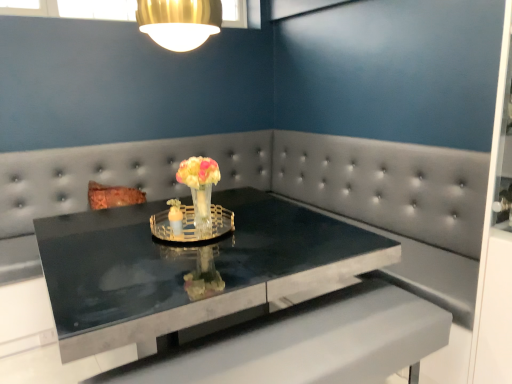
Image resolution: width=512 pixels, height=384 pixels. What do you see at coordinates (188, 267) in the screenshot?
I see `black marble table at center` at bounding box center [188, 267].

Locate an element on the screen. clear glass candle holder at center, acting as the second candle holder starting from the left is located at coordinates pyautogui.click(x=192, y=225).

This screenshot has width=512, height=384. Find the location of `black marble table at center`. black marble table at center is located at coordinates (188, 267).

Does point (178, 224) come farther from viewer compared to point (205, 218)?

That is False.

How different are the orientations of translucent glass candle holder at center, which is the 1th candle holder from left to right, and translucent glass vase at center in degrees?

0.000926 degrees.

Looking at their sizes, would you say translucent glass candle holder at center, which is the 1th candle holder from left to right, is wider or thinner than translucent glass vase at center?

In the image, translucent glass candle holder at center, which is the 1th candle holder from left to right, appears to be more narrow than translucent glass vase at center.

Does translucent glass candle holder at center, which is the 1th candle holder from left to right, have a greater height compared to translucent glass vase at center?

No.

Considering the sizes of objects translucent glass candle holder at center, which is the 1th candle holder from left to right, and clear glass candle holder at center, acting as the second candle holder starting from the left, in the image provided, who is smaller, translucent glass candle holder at center, which is the 1th candle holder from left to right, or clear glass candle holder at center, acting as the second candle holder starting from the left,?

With smaller size is translucent glass candle holder at center, which is the 1th candle holder from left to right.

Does translucent glass candle holder at center, which is the 1th candle holder from left to right, have a greater width compared to clear glass candle holder at center, placed as the 1th candle holder when sorted from right to left?

No, translucent glass candle holder at center, which is the 1th candle holder from left to right, is not wider than clear glass candle holder at center, placed as the 1th candle holder when sorted from right to left.

Considering the relative positions of translucent glass candle holder at center, which is the 1th candle holder from left to right, and clear glass candle holder at center, placed as the 1th candle holder when sorted from right to left, in the image provided, is translucent glass candle holder at center, which is the 1th candle holder from left to right, in front of clear glass candle holder at center, placed as the 1th candle holder when sorted from right to left,?

No, translucent glass candle holder at center, which is the 1th candle holder from left to right, is further to the viewer.

Which object is positioned more to the right, translucent glass candle holder at center, which is the 1th candle holder from left to right, or clear glass candle holder at center, placed as the 1th candle holder when sorted from right to left?

From the viewer's perspective, clear glass candle holder at center, placed as the 1th candle holder when sorted from right to left, appears more on the right side.

Is translucent glass candle holder at center, which is the 1th candle holder from left to right, positioned in front of black marble table at center?

No, translucent glass candle holder at center, which is the 1th candle holder from left to right, is behind black marble table at center.

Is translucent glass candle holder at center, the second candle holder when ordered from right to left, in contact with black marble table at center?

No, translucent glass candle holder at center, the second candle holder when ordered from right to left, is not with black marble table at center.

Could you tell me if translucent glass candle holder at center, which is the 1th candle holder from left to right, is turned towards black marble table at center?

No, translucent glass candle holder at center, which is the 1th candle holder from left to right, is not facing towards black marble table at center.

Considering the points (178, 229) and (44, 246), which point is in front, point (178, 229) or point (44, 246)?

Point (178, 229)

Can you confirm if black marble table at center is smaller than translucent glass candle holder at center, which is the 1th candle holder from left to right?

Incorrect, black marble table at center is not smaller in size than translucent glass candle holder at center, which is the 1th candle holder from left to right.

Between black marble table at center and translucent glass candle holder at center, which is the 1th candle holder from left to right, which one appears on the right side from the viewer's perspective?

black marble table at center is more to the right.

Is translucent glass candle holder at center, which is the 1th candle holder from left to right, at the back of black marble table at center?

No, black marble table at center is not facing away from translucent glass candle holder at center, which is the 1th candle holder from left to right.

From the image's perspective, is black marble table at center above or below translucent glass candle holder at center, the second candle holder when ordered from right to left?

black marble table at center is situated lower than translucent glass candle holder at center, the second candle holder when ordered from right to left, in the image.

Does clear glass candle holder at center, placed as the 1th candle holder when sorted from right to left, appear on the left side of black marble table at center?

Correct, you'll find clear glass candle holder at center, placed as the 1th candle holder when sorted from right to left, to the left of black marble table at center.

Can you confirm if clear glass candle holder at center, placed as the 1th candle holder when sorted from right to left, is thinner than black marble table at center?

Yes, clear glass candle holder at center, placed as the 1th candle holder when sorted from right to left, is thinner than black marble table at center.

Is the position of clear glass candle holder at center, placed as the 1th candle holder when sorted from right to left, more distant than that of black marble table at center?

Yes, clear glass candle holder at center, placed as the 1th candle holder when sorted from right to left, is further from the viewer.

Could you measure the distance between clear glass candle holder at center, acting as the second candle holder starting from the left, and black marble table at center?

clear glass candle holder at center, acting as the second candle holder starting from the left, is 9.05 inches away from black marble table at center.

From the image's perspective, relative to black marble table at center, is translucent glass vase at center above or below?

Clearly, from the image's perspective, translucent glass vase at center is above black marble table at center.

You are a GUI agent. You are given a task and a screenshot of the screen. Output one action in this format:
    pyautogui.click(x=<x>, y=<y>)
    Task: Click on the table on the right of translucent glass vase at center
    
    Given the screenshot: What is the action you would take?
    pyautogui.click(x=188, y=267)

Is translucent glass vase at center wider or thinner than black marble table at center?

In the image, translucent glass vase at center appears to be more narrow than black marble table at center.

Can you tell me how much translucent glass vase at center and black marble table at center differ in facing direction?

The facing directions of translucent glass vase at center and black marble table at center are 7.48 degrees apart.

Can translucent glass vase at center be found inside black marble table at center?

No, translucent glass vase at center is not inside black marble table at center.

Is black marble table at center placed right next to translucent glass vase at center?

black marble table at center is not next to translucent glass vase at center, and they're not touching.

Does point (295, 274) appear closer or farther from the camera than point (156, 228)?

Point (295, 274) is closer to the camera than point (156, 228).

Considering the sizes of objects black marble table at center and translucent glass vase at center in the image provided, who is taller, black marble table at center or translucent glass vase at center?

With more height is black marble table at center.

This screenshot has width=512, height=384. There is a translucent glass vase at center. Find the location of `the 1st candle holder below it (from the image's perspective)`. the 1st candle holder below it (from the image's perspective) is located at coordinates click(175, 217).

Where is `candle holder on the right side of translucent glass candle holder at center, the second candle holder when ordered from right to left`? The height and width of the screenshot is (384, 512). candle holder on the right side of translucent glass candle holder at center, the second candle holder when ordered from right to left is located at coordinates coord(192,225).

When comparing their distances from clear glass candle holder at center, placed as the 1th candle holder when sorted from right to left, does translucent glass candle holder at center, the second candle holder when ordered from right to left, or black marble table at center seem further?

Based on the image, black marble table at center appears to be further to clear glass candle holder at center, placed as the 1th candle holder when sorted from right to left.

Based on their spatial positions, is clear glass candle holder at center, placed as the 1th candle holder when sorted from right to left, or black marble table at center further from translucent glass vase at center?

black marble table at center is further to translucent glass vase at center.

When comparing their distances from clear glass candle holder at center, placed as the 1th candle holder when sorted from right to left, does black marble table at center or translucent glass candle holder at center, which is the 1th candle holder from left to right, seem closer?

translucent glass candle holder at center, which is the 1th candle holder from left to right, lies closer to clear glass candle holder at center, placed as the 1th candle holder when sorted from right to left, than the other object.

Considering their positions, is black marble table at center positioned further to clear glass candle holder at center, acting as the second candle holder starting from the left, than translucent glass vase at center?

The object further to clear glass candle holder at center, acting as the second candle holder starting from the left, is black marble table at center.

Which object lies further to the anchor point translucent glass candle holder at center, which is the 1th candle holder from left to right, clear glass candle holder at center, acting as the second candle holder starting from the left, or translucent glass vase at center?

translucent glass vase at center is further to translucent glass candle holder at center, which is the 1th candle holder from left to right.

Consider the image. Considering their positions, is translucent glass vase at center positioned further to translucent glass candle holder at center, which is the 1th candle holder from left to right, than black marble table at center?

black marble table at center.

Consider the image. When comparing their distances from translucent glass vase at center, does translucent glass candle holder at center, which is the 1th candle holder from left to right, or clear glass candle holder at center, acting as the second candle holder starting from the left, seem closer?

clear glass candle holder at center, acting as the second candle holder starting from the left, is closer to translucent glass vase at center.

From the image, which object appears to be farther from translucent glass candle holder at center, the second candle holder when ordered from right to left, black marble table at center or translucent glass vase at center?

Based on the image, black marble table at center appears to be further to translucent glass candle holder at center, the second candle holder when ordered from right to left.

I want to click on candle holder between black marble table at center and translucent glass vase at center in the front-back direction, so click(x=192, y=225).

This screenshot has height=384, width=512. Find the location of `floral arrangement located between clear glass candle holder at center, placed as the 1th candle holder when sorted from right to left, and translucent glass candle holder at center, the second candle holder when ordered from right to left, in the depth direction`. floral arrangement located between clear glass candle holder at center, placed as the 1th candle holder when sorted from right to left, and translucent glass candle holder at center, the second candle holder when ordered from right to left, in the depth direction is located at coordinates (194, 206).

The image size is (512, 384). I want to click on floral arrangement located between black marble table at center and translucent glass candle holder at center, which is the 1th candle holder from left to right, in the depth direction, so click(x=194, y=206).

The height and width of the screenshot is (384, 512). Find the location of `candle holder between black marble table at center and translucent glass candle holder at center, which is the 1th candle holder from left to right, in the front-back direction`. candle holder between black marble table at center and translucent glass candle holder at center, which is the 1th candle holder from left to right, in the front-back direction is located at coordinates (192, 225).